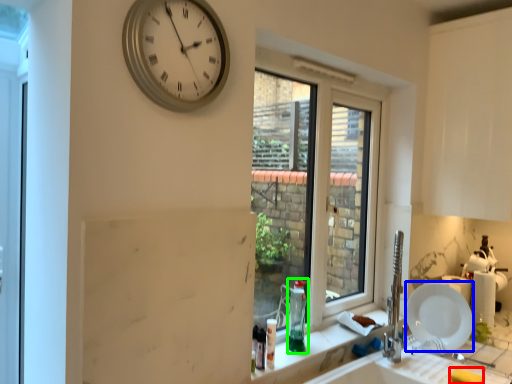
Question: Estimate the real-world distances between objects in this image. Which object is farther from soap (highlighted by a red box), plate (highlighted by a blue box) or bottle (highlighted by a green box)?

Choices:
 (A) plate
 (B) bottle

Answer: (B)